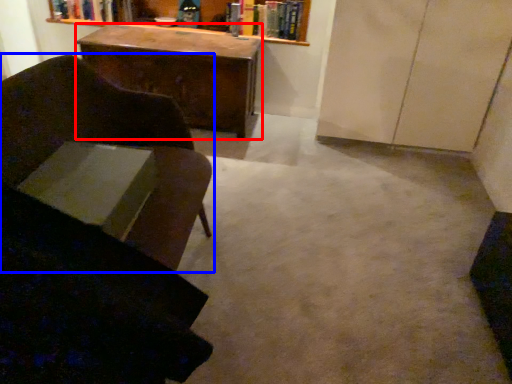
Question: Which of the following is the closest to the observer, desk (highlighted by a red box) or chair (highlighted by a blue box)?

Choices:
 (A) desk
 (B) chair

Answer: (B)